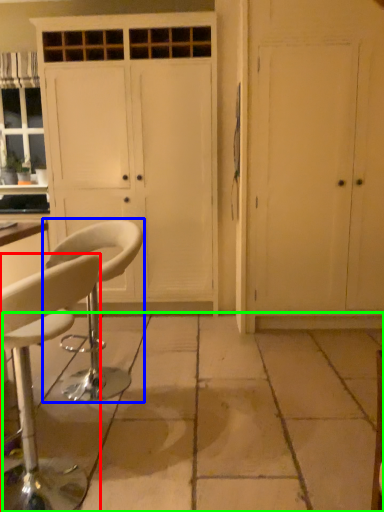
Question: Considering the real-world distances, which object is closest to chair (highlighted by a red box)? chair (highlighted by a blue box) or concrete (highlighted by a green box).

Choices:
 (A) chair
 (B) concrete

Answer: (A)